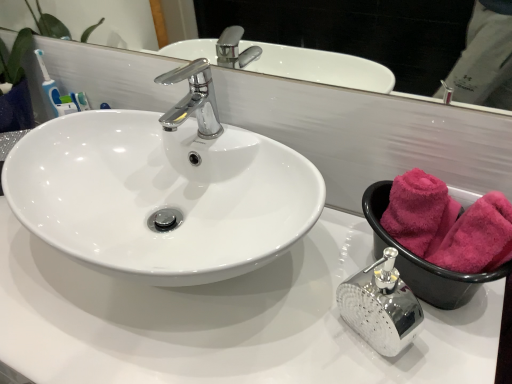
Where is `free space behind polished chrome soap dispenser at lower right`? This screenshot has height=384, width=512. free space behind polished chrome soap dispenser at lower right is located at coordinates (332, 256).